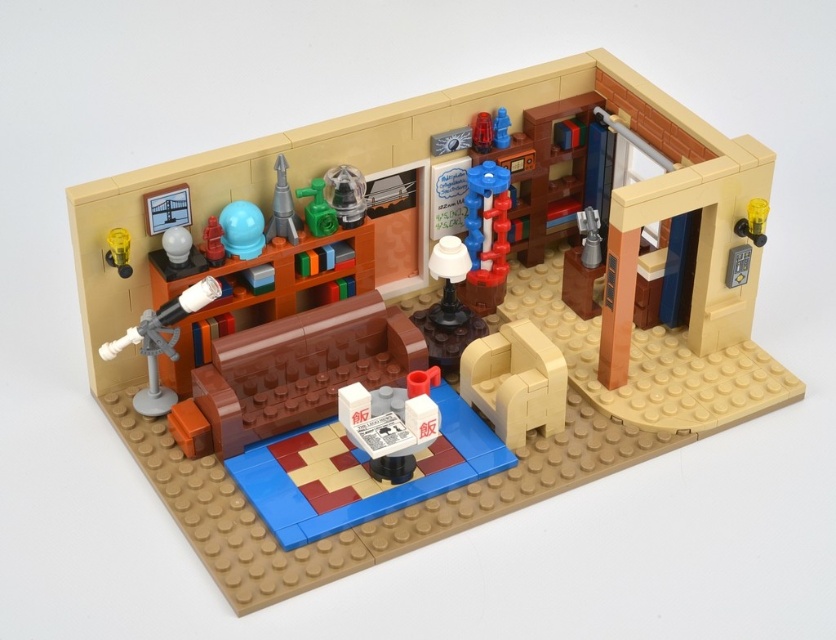
You are a toy organizer trying to arrange the green plastic rocket at center and the blue plastic rocket at upper center on a shelf that can only hold items spaced 12 inches apart. Can you place them side by side without moving them closer than the minimum distance required?

The green plastic rocket at center is 11.59 inches from blue plastic rocket at upper center. Since the required minimum distance is 12 inches, the rockets cannot be placed side by side on the shelf without violating the spacing requirement.